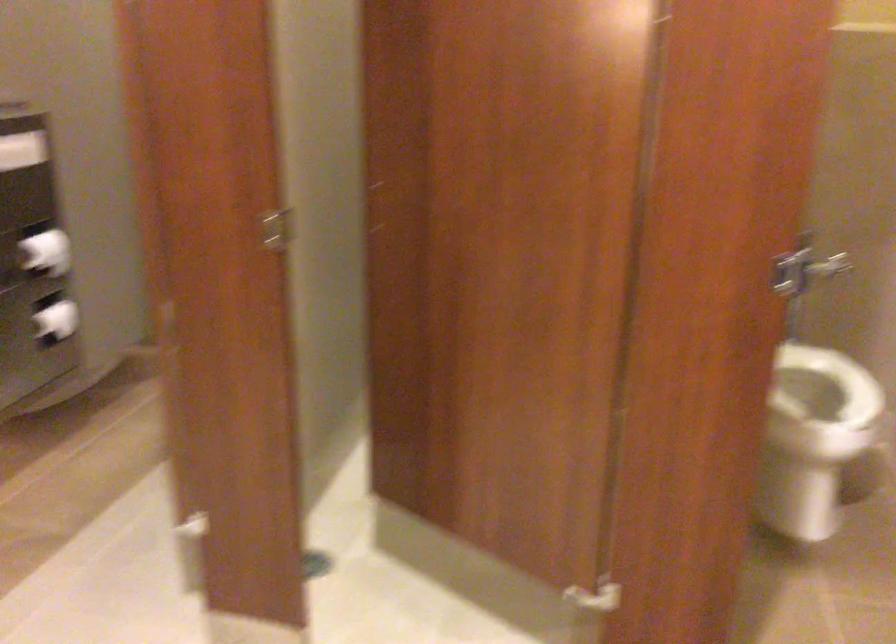
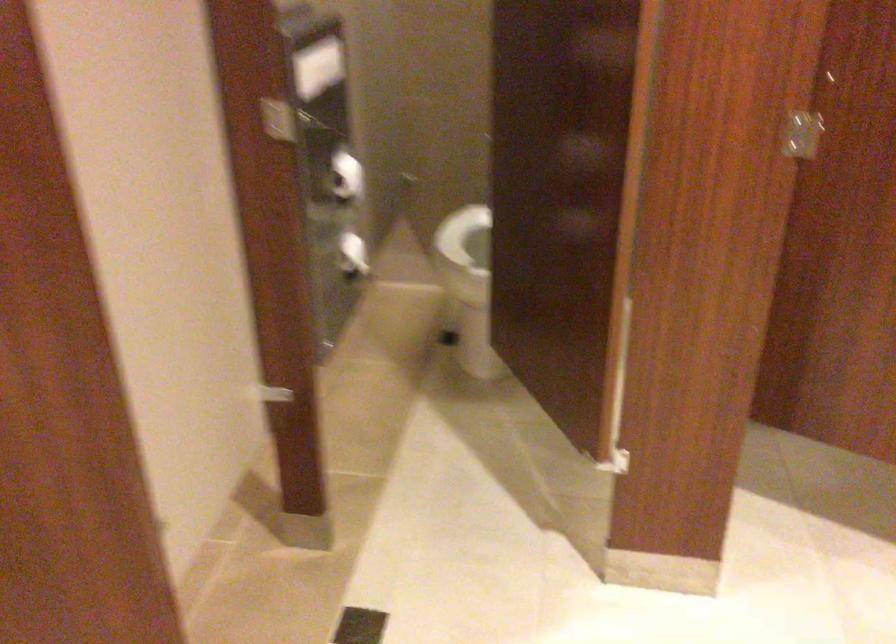
Question: In a continuous first-person perspective shot, in which direction is the camera moving?

Choices:
 (A) Left
 (B) Right
 (C) Forward
 (D) Backward

Answer: (A)